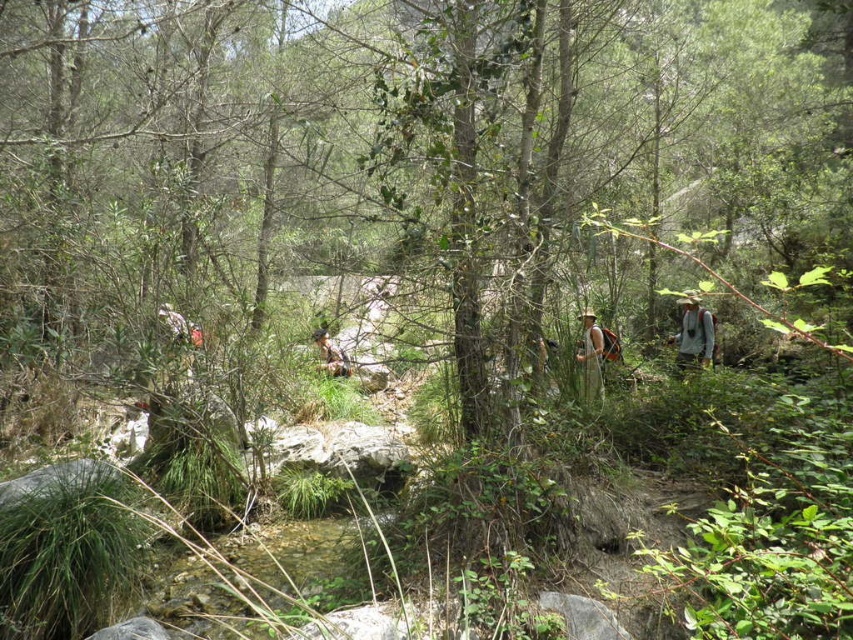
Does camouflage fabric shirt at right have a lesser width compared to brown leather backpack at center?

Correct, camouflage fabric shirt at right's width is less than brown leather backpack at center's.

In the scene shown: Who is lower down, camouflage fabric shirt at right or brown leather backpack at center?

brown leather backpack at center is below.

I want to click on camouflage fabric shirt at right, so point(693,332).

At what (x,y) coordinates should I click in order to perform the action: click on camouflage fabric shirt at right. Please return your answer as a coordinate pair (x, y). Looking at the image, I should click on (693, 332).

Is white fabric dress at center to the right of brown leather backpack at center from the viewer's perspective?

Indeed, white fabric dress at center is positioned on the right side of brown leather backpack at center.

Does white fabric dress at center have a greater height compared to brown leather backpack at center?

Yes, white fabric dress at center is taller than brown leather backpack at center.

Which is behind, point (585, 397) or point (329, 372)?

The point (329, 372) is more distant.

I want to click on white fabric dress at center, so click(590, 356).

Which is below, camouflage fabric shirt at right or white fabric dress at center?

white fabric dress at center is below.

From the picture: Does camouflage fabric shirt at right have a smaller size compared to white fabric dress at center?

Yes, camouflage fabric shirt at right is smaller than white fabric dress at center.

This screenshot has width=853, height=640. I want to click on camouflage fabric shirt at right, so click(x=693, y=332).

Where is `camouflage fabric shirt at right`? camouflage fabric shirt at right is located at coordinates (693, 332).